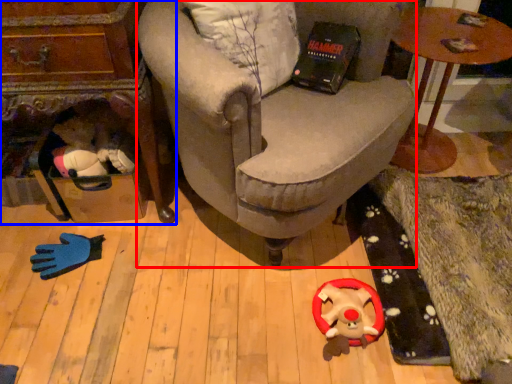
Question: Which object is closer to the camera taking this photo, chair (highlighted by a red box) or table (highlighted by a blue box)?

Choices:
 (A) chair
 (B) table

Answer: (A)